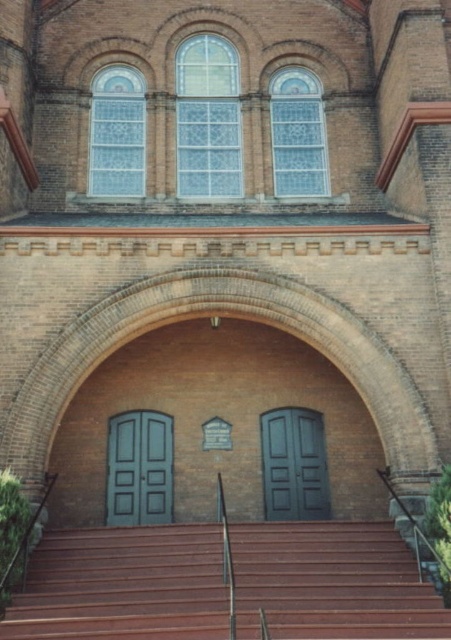
Can you confirm if brown wooden stairs at center is positioned to the left of teal glossy door at center?

No, brown wooden stairs at center is not to the left of teal glossy door at center.

This screenshot has height=640, width=451. Identify the location of brown wooden stairs at center. (124, 586).

Where is `brown wooden stairs at center`? brown wooden stairs at center is located at coordinates (124, 586).

Where is `brown wooden stairs at center`? The width and height of the screenshot is (451, 640). brown wooden stairs at center is located at coordinates (124, 586).

Based on the photo, which is more to the left, brown wooden stairs at center or matte black door at center?

Positioned to the left is brown wooden stairs at center.

Measure the distance between brown wooden stairs at center and camera.

The distance of brown wooden stairs at center from camera is 22.55 meters.

You are a GUI agent. You are given a task and a screenshot of the screen. Output one action in this format:
    pyautogui.click(x=<x>, y=<y>)
    Task: Click on the brown wooden stairs at center
    
    Given the screenshot: What is the action you would take?
    pyautogui.click(x=124, y=586)

Who is positioned more to the left, teal glossy door at center or matte black door at center?

Positioned to the left is teal glossy door at center.

Is teal glossy door at center below matte black door at center?

No, teal glossy door at center is not below matte black door at center.

Locate an element on the screen. teal glossy door at center is located at coordinates (139, 468).

Where is `teal glossy door at center`? teal glossy door at center is located at coordinates tap(139, 468).